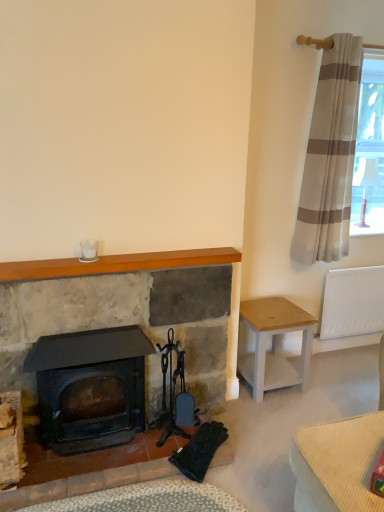
The width and height of the screenshot is (384, 512). What are the coordinates of `free point above white plastic radiator at right (from a real-world perspective)` in the screenshot? It's located at (357, 266).